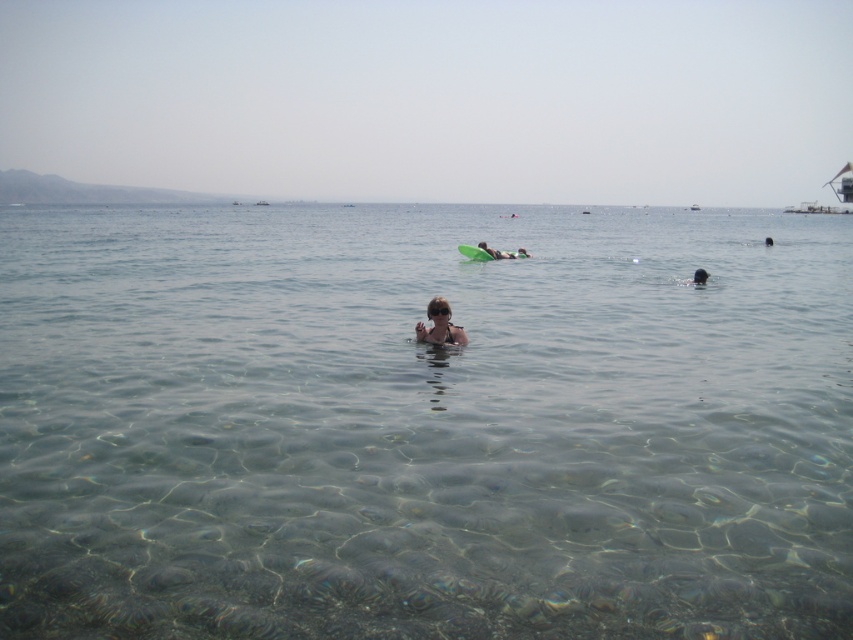
Question: Which object is closer to the camera taking this photo?

Choices:
 (A) dark skin at center
 (B) clear water at center
 (C) light brown skin at center

Answer: (B)

Question: Is clear water at center in front of dark skin at center?

Choices:
 (A) no
 (B) yes

Answer: (B)

Question: Can you confirm if clear water at center is bigger than light brown skin at center?

Choices:
 (A) no
 (B) yes

Answer: (B)

Question: Which point appears farthest from the camera in this image?

Choices:
 (A) (459, 332)
 (B) (694, 276)

Answer: (B)

Question: Which is farther from the light brown skin at center?

Choices:
 (A) dark skin at center
 (B) clear water at center

Answer: (B)

Question: In this image, where is clear water at center located relative to dark skin at center?

Choices:
 (A) below
 (B) above

Answer: (B)